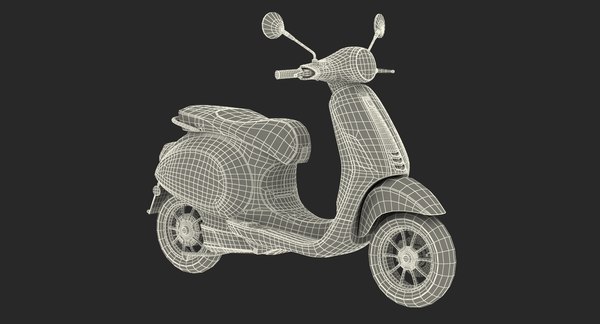
The image size is (600, 324). Identify the location of seat. (249, 125), (210, 118).